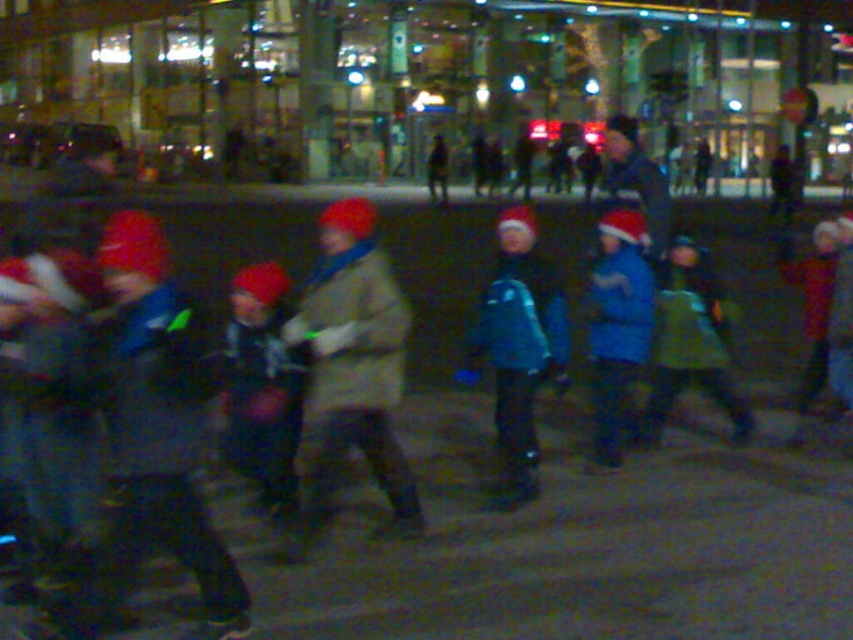
Does velvet red hat at center appear over blue matte jacket at center?

Incorrect, velvet red hat at center is not positioned above blue matte jacket at center.

From the picture: Does velvet red hat at center have a larger size compared to blue matte jacket at center?

No, velvet red hat at center is not bigger than blue matte jacket at center.

Is point (305, 339) more distant than point (643, 308)?

That is False.

The height and width of the screenshot is (640, 853). Find the location of `velvet red hat at center`. velvet red hat at center is located at coordinates (263, 387).

Based on the photo, between camouflage fabric jacket at center and velvet red hat at center, which one is positioned lower?

velvet red hat at center is lower down.

Image resolution: width=853 pixels, height=640 pixels. I want to click on camouflage fabric jacket at center, so click(x=354, y=369).

At what (x,y) coordinates should I click in order to perform the action: click on camouflage fabric jacket at center. Please return your answer as a coordinate pair (x, y). Looking at the image, I should click on (354, 369).

I want to click on camouflage fabric jacket at center, so click(x=354, y=369).

Is the position of camouflage fabric jacket at center more distant than that of teal fabric jacket at center?

No, it is in front of teal fabric jacket at center.

Does camouflage fabric jacket at center appear on the right side of teal fabric jacket at center?

In fact, camouflage fabric jacket at center is to the left of teal fabric jacket at center.

Describe the element at coordinates (354, 369) in the screenshot. I see `camouflage fabric jacket at center` at that location.

The width and height of the screenshot is (853, 640). In order to click on camouflage fabric jacket at center in this screenshot , I will do `click(354, 369)`.